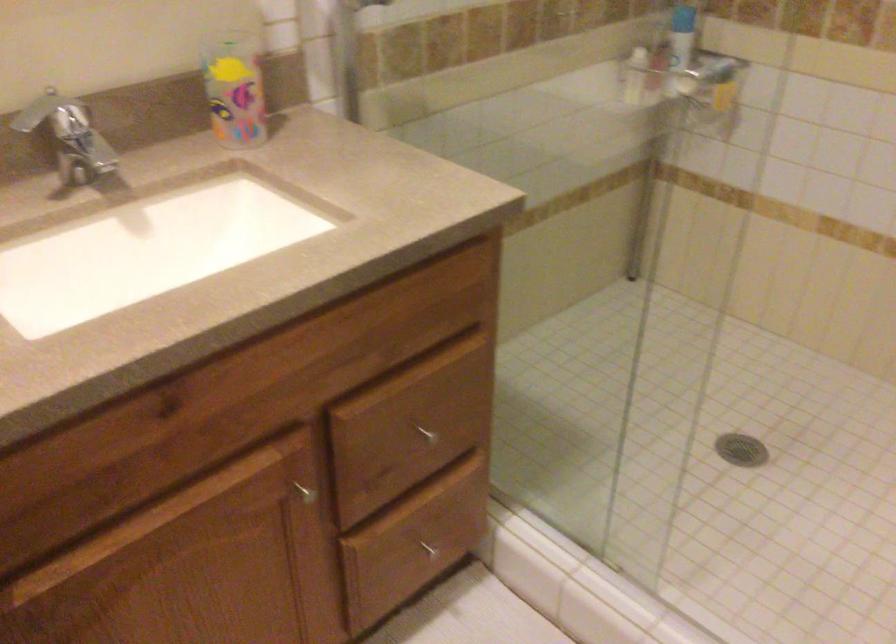
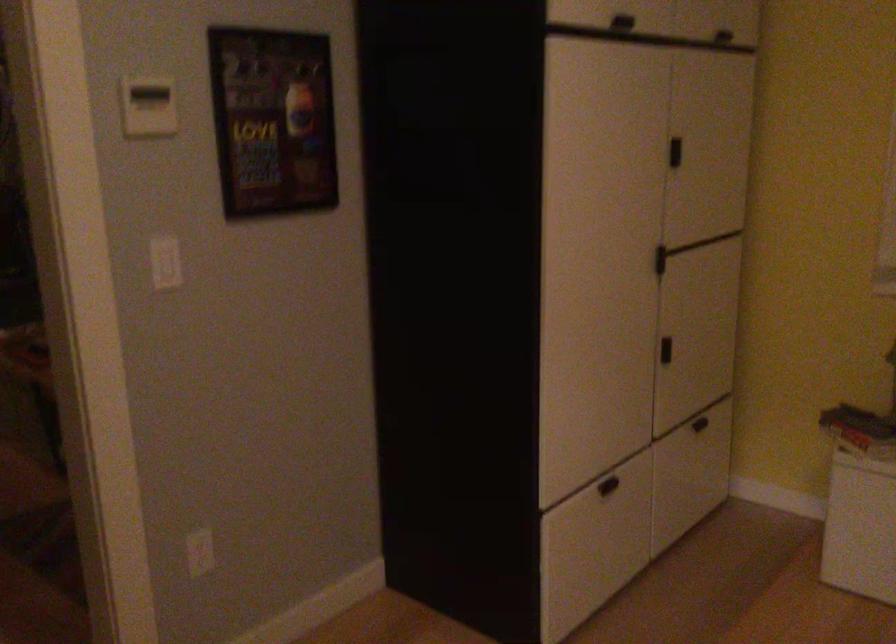
Question: The images are taken continuously from a first-person perspective. In which direction is your viewpoint rotating?

Choices:
 (A) Left
 (B) Right
 (C) Up
 (D) Down

Answer: (B)